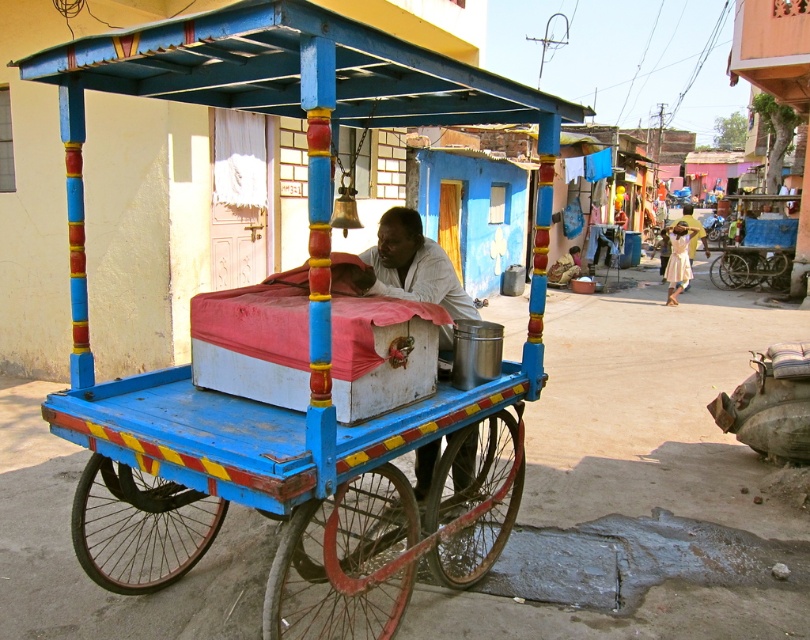
Question: Does wooden cart at center appear under white matte cart at center?

Choices:
 (A) yes
 (B) no

Answer: (A)

Question: Is wooden cart at center below white matte cart at center?

Choices:
 (A) no
 (B) yes

Answer: (B)

Question: Is wooden cart at center above white matte cart at center?

Choices:
 (A) no
 (B) yes

Answer: (A)

Question: Which of the following is the closest to the observer?

Choices:
 (A) (322, 582)
 (B) (382, 237)

Answer: (A)

Question: Which object is farther from the camera taking this photo?

Choices:
 (A) white matte cart at center
 (B) wooden cart at center

Answer: (A)

Question: Which point appears closest to the camera in this image?

Choices:
 (A) (327, 518)
 (B) (420, 268)

Answer: (A)